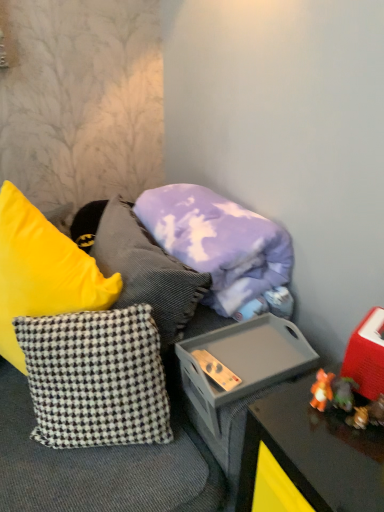
What do you see at coordinates (96, 378) in the screenshot? The width and height of the screenshot is (384, 512). I see `black and white checkered pillow at center, the 2th pillow positioned from the top` at bounding box center [96, 378].

Find the location of a particular element. This screenshot has width=384, height=512. black and white checkered pillow at center, the 2th pillow positioned from the top is located at coordinates (96, 378).

From the picture: How much space does black and white checkered pillow at center, the first pillow positioned from the bottom, occupy vertically?

It is 14.45 inches.

Based on the photo, how much space does black and white checkered pillow at center, the 2th pillow positioned from the top, occupy horizontally?

black and white checkered pillow at center, the 2th pillow positioned from the top, is 7.38 inches wide.

What is the approximate width of purple cotton pillow at center, the first pillow positioned from the top?

purple cotton pillow at center, the first pillow positioned from the top, is 13.37 inches wide.

What do you see at coordinates (218, 242) in the screenshot? I see `purple cotton pillow at center, which ranks as the second pillow in bottom-to-top order` at bounding box center [218, 242].

This screenshot has height=512, width=384. I want to click on purple cotton pillow at center, which ranks as the second pillow in bottom-to-top order, so click(x=218, y=242).

In order to face purple cotton pillow at center, which ranks as the second pillow in bottom-to-top order, should I rotate leftwards or rightwards?

A 2.367 degree turn to the right will do.

Find the location of a particular element. This screenshot has height=512, width=384. black and white checkered pillow at center, the 2th pillow positioned from the top is located at coordinates (96, 378).

Which is more to the right, purple cotton pillow at center, which ranks as the second pillow in bottom-to-top order, or black and white checkered pillow at center, the 2th pillow positioned from the top?

Positioned to the right is purple cotton pillow at center, which ranks as the second pillow in bottom-to-top order.

Is purple cotton pillow at center, the first pillow positioned from the top, closer to the viewer compared to black and white checkered pillow at center, the first pillow positioned from the bottom?

No, purple cotton pillow at center, the first pillow positioned from the top, is further to the viewer.

Considering the positions of point (245, 275) and point (132, 412), is point (245, 275) closer or farther from the camera than point (132, 412)?

Clearly, point (245, 275) is more distant from the camera than point (132, 412).

From the image's perspective, which one is positioned higher, purple cotton pillow at center, the first pillow positioned from the top, or black and white checkered pillow at center, the 2th pillow positioned from the top?

purple cotton pillow at center, the first pillow positioned from the top.

From a real-world perspective, does purple cotton pillow at center, which ranks as the second pillow in bottom-to-top order, sit lower than black and white checkered pillow at center, the 2th pillow positioned from the top?

Incorrect, from a real-world perspective, purple cotton pillow at center, which ranks as the second pillow in bottom-to-top order, is higher than black and white checkered pillow at center, the 2th pillow positioned from the top.

Which object is wider, purple cotton pillow at center, the first pillow positioned from the top, or black and white checkered pillow at center, the 2th pillow positioned from the top?

With larger width is purple cotton pillow at center, the first pillow positioned from the top.

Who is shorter, purple cotton pillow at center, the first pillow positioned from the top, or black and white checkered pillow at center, the first pillow positioned from the bottom?

purple cotton pillow at center, the first pillow positioned from the top, is shorter.

Looking at the image, does purple cotton pillow at center, the first pillow positioned from the top, seem bigger or smaller compared to black and white checkered pillow at center, the 2th pillow positioned from the top?

Clearly, purple cotton pillow at center, the first pillow positioned from the top, is larger in size than black and white checkered pillow at center, the 2th pillow positioned from the top.

Is black and white checkered pillow at center, the first pillow positioned from the bottom, completely or partially inside purple cotton pillow at center, which ranks as the second pillow in bottom-to-top order?

No, black and white checkered pillow at center, the first pillow positioned from the bottom, is not inside purple cotton pillow at center, which ranks as the second pillow in bottom-to-top order.

Is purple cotton pillow at center, the first pillow positioned from the top, touching black and white checkered pillow at center, the 2th pillow positioned from the top?

No, purple cotton pillow at center, the first pillow positioned from the top, is not next to black and white checkered pillow at center, the 2th pillow positioned from the top.

Is purple cotton pillow at center, the first pillow positioned from the top, facing away from black and white checkered pillow at center, the first pillow positioned from the bottom?

No.

How different are the orientations of purple cotton pillow at center, the first pillow positioned from the top, and black and white checkered pillow at center, the 2th pillow positioned from the top, in degrees?

The angle between the facing direction of purple cotton pillow at center, the first pillow positioned from the top, and the facing direction of black and white checkered pillow at center, the 2th pillow positioned from the top, is 61.4 degrees.

Based on the photo, measure the distance from purple cotton pillow at center, which ranks as the second pillow in bottom-to-top order, to black and white checkered pillow at center, the first pillow positioned from the bottom.

14.60 inches.

You are a GUI agent. You are given a task and a screenshot of the screen. Output one action in this format:
    pyautogui.click(x=<x>, y=<y>)
    Task: Click on the pillow below the purple cotton pillow at center, which ranks as the second pillow in bottom-to-top order (from the image's perspective)
    
    Given the screenshot: What is the action you would take?
    pyautogui.click(x=96, y=378)

Is black and white checkered pillow at center, the first pillow positioned from the bottom, at the right side of purple cotton pillow at center, which ranks as the second pillow in bottom-to-top order?

Incorrect, black and white checkered pillow at center, the first pillow positioned from the bottom, is not on the right side of purple cotton pillow at center, which ranks as the second pillow in bottom-to-top order.

Relative to purple cotton pillow at center, the first pillow positioned from the top, is black and white checkered pillow at center, the 2th pillow positioned from the top, in front or behind?

Visually, black and white checkered pillow at center, the 2th pillow positioned from the top, is located in front of purple cotton pillow at center, the first pillow positioned from the top.

Does point (94, 316) lie in front of point (184, 215)?

Yes, point (94, 316) is in front of point (184, 215).

From the image's perspective, which object appears higher, black and white checkered pillow at center, the first pillow positioned from the bottom, or purple cotton pillow at center, the first pillow positioned from the top?

purple cotton pillow at center, the first pillow positioned from the top, is shown above in the image.

From a real-world perspective, which object rests below the other?

From a 3D spatial view, black and white checkered pillow at center, the first pillow positioned from the bottom, is below.

Is black and white checkered pillow at center, the 2th pillow positioned from the top, wider or thinner than purple cotton pillow at center, which ranks as the second pillow in bottom-to-top order?

black and white checkered pillow at center, the 2th pillow positioned from the top, is thinner than purple cotton pillow at center, which ranks as the second pillow in bottom-to-top order.

Does black and white checkered pillow at center, the 2th pillow positioned from the top, have a lesser height compared to purple cotton pillow at center, the first pillow positioned from the top?

In fact, black and white checkered pillow at center, the 2th pillow positioned from the top, may be taller than purple cotton pillow at center, the first pillow positioned from the top.

Is black and white checkered pillow at center, the first pillow positioned from the bottom, smaller than purple cotton pillow at center, the first pillow positioned from the top?

Correct, black and white checkered pillow at center, the first pillow positioned from the bottom, occupies less space than purple cotton pillow at center, the first pillow positioned from the top.

Is black and white checkered pillow at center, the 2th pillow positioned from the top, inside the boundaries of purple cotton pillow at center, which ranks as the second pillow in bottom-to-top order, or outside?

The correct answer is: outside.

Is black and white checkered pillow at center, the 2th pillow positioned from the top, not close to purple cotton pillow at center, the first pillow positioned from the top?

No, there isn't a large distance between black and white checkered pillow at center, the 2th pillow positioned from the top, and purple cotton pillow at center, the first pillow positioned from the top.

Is black and white checkered pillow at center, the first pillow positioned from the bottom, positioned with its back to purple cotton pillow at center, which ranks as the second pillow in bottom-to-top order?

Yes, black and white checkered pillow at center, the first pillow positioned from the bottom,'s orientation is away from purple cotton pillow at center, which ranks as the second pillow in bottom-to-top order.

Can you tell me how much black and white checkered pillow at center, the 2th pillow positioned from the top, and purple cotton pillow at center, which ranks as the second pillow in bottom-to-top order, differ in facing direction?

The angle between the facing direction of black and white checkered pillow at center, the 2th pillow positioned from the top, and the facing direction of purple cotton pillow at center, which ranks as the second pillow in bottom-to-top order, is 61.4 degrees.

Where is `pillow in front of the purple cotton pillow at center, the first pillow positioned from the top`? This screenshot has height=512, width=384. pillow in front of the purple cotton pillow at center, the first pillow positioned from the top is located at coordinates (96, 378).

Where is `pillow that appears below the purple cotton pillow at center, the first pillow positioned from the top (from the image's perspective)`? Image resolution: width=384 pixels, height=512 pixels. pillow that appears below the purple cotton pillow at center, the first pillow positioned from the top (from the image's perspective) is located at coordinates (96, 378).

In order to click on pillow above the black and white checkered pillow at center, the first pillow positioned from the bottom (from the image's perspective) in this screenshot , I will do `click(218, 242)`.